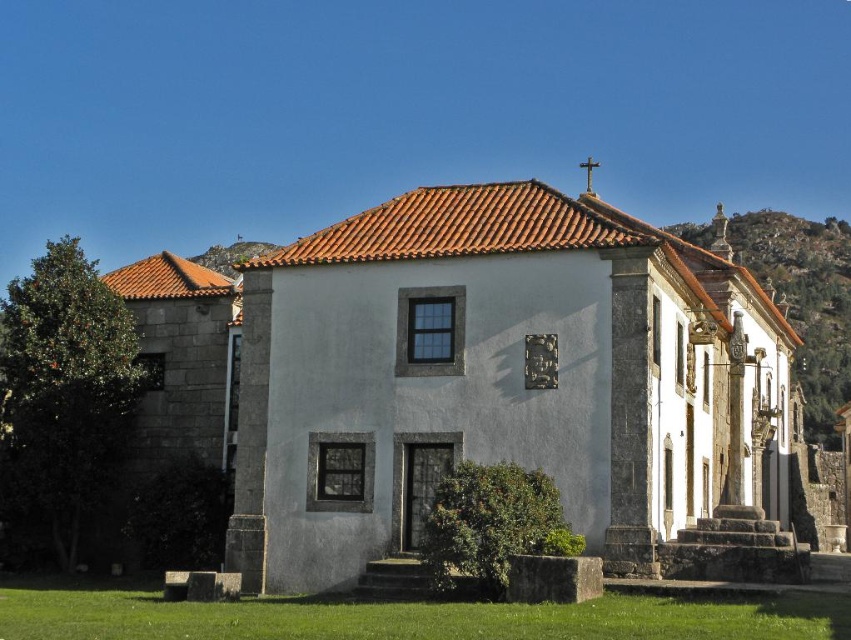
Question: Which of the following is the closest to the observer?

Choices:
 (A) white stone chapel at center
 (B) rustic stone hillside at upper right

Answer: (A)

Question: Is white stone chapel at center below rustic stone hillside at upper right?

Choices:
 (A) no
 (B) yes

Answer: (B)

Question: Does white stone chapel at center lie in front of rustic stone hillside at upper right?

Choices:
 (A) yes
 (B) no

Answer: (A)

Question: Is the position of white stone chapel at center less distant than that of rustic stone hillside at upper right?

Choices:
 (A) no
 (B) yes

Answer: (B)

Question: Which point appears closest to the camera in this image?

Choices:
 (A) (306, 317)
 (B) (832, 358)

Answer: (A)